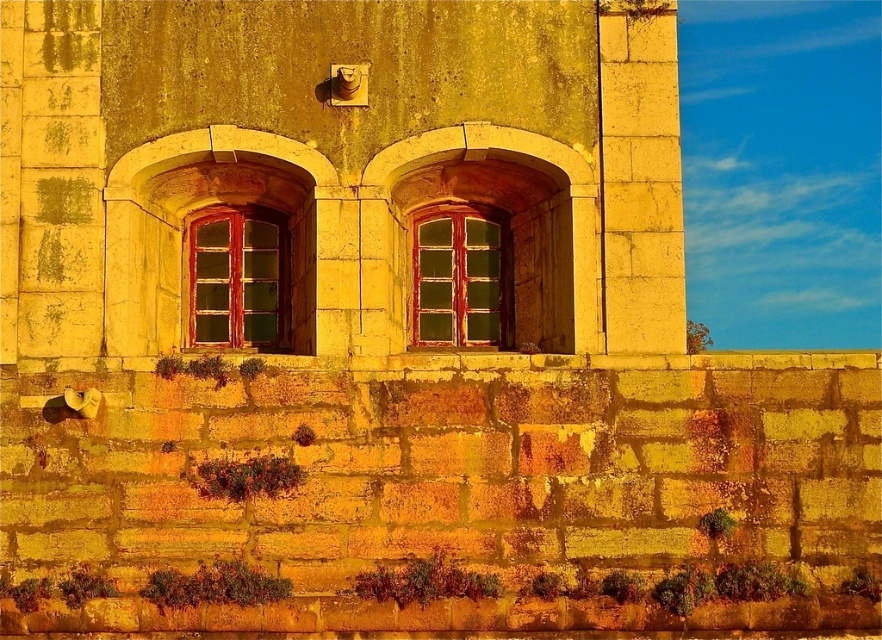
You are standing in front of a building with two windows at the center. The windows are labeled as the matte red wooden window at center and the green glass window at center. Which window is positioned to the left when viewed from the front?

The matte red wooden window at center is to the left of the green glass window at center.

You are a window cleaner standing on the ground looking up at the building. You need to clean both the matte red wooden window at center and the green glass window at center. Which window should you clean first if you want to start from the lower one?

The matte red wooden window at center is located below the green glass window at center, so you should clean the matte red wooden window at center first since it is lower.

You are a painter standing in front of the building and want to paint both the matte red wooden window at center and the green glass window at center. Which window should you paint first to avoid having to repaint the other one later?

You should paint the matte red wooden window at center first because it is in front of the green glass window at center, so painting the front one first would prevent the need to repaint the one behind it later.